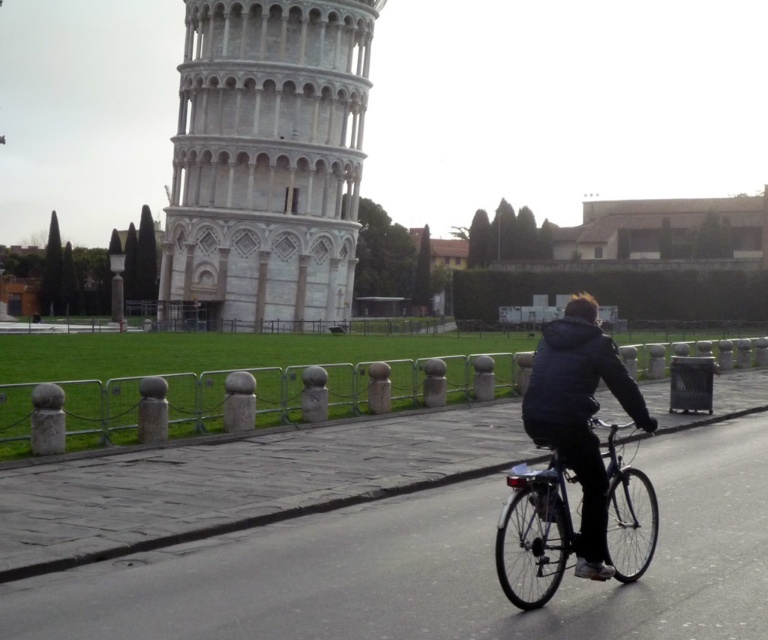
You are standing at the point marked by the coordinates point (578, 413) in the image. What object is directly in front of you?

The point (578, 413) marks the dark gray jacket at center, so the dark gray jacket at center is directly in front of you.

You are a photographer planning to take a picture of the white stone tower at center and the shiny metallic bicycle at lower right. Which object should you focus on first if you want to capture both in the same frame without adjusting your camera settings?

The white stone tower at center is taller than the shiny metallic bicycle at lower right, so you should focus on the white stone tower at center first to ensure it is fully in frame before adjusting for the bicycle.

You are standing at the point marked by coordinates point (267,161). What iconic structure would you see directly in front of you?

The white stone tower at center is located at point (267,161), so standing at that point, you would see the white stone tower at center directly in front of you.